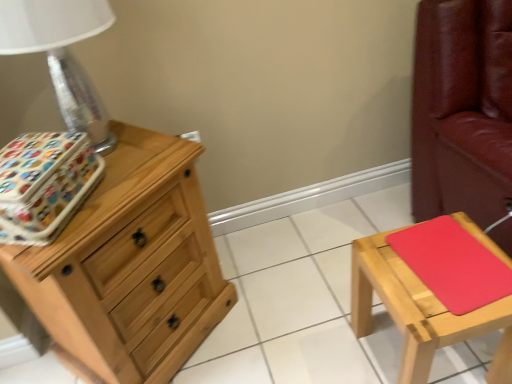
Identify the location of empty space that is ontop of matte wood stool at right (from a real-world perspective). (446, 266).